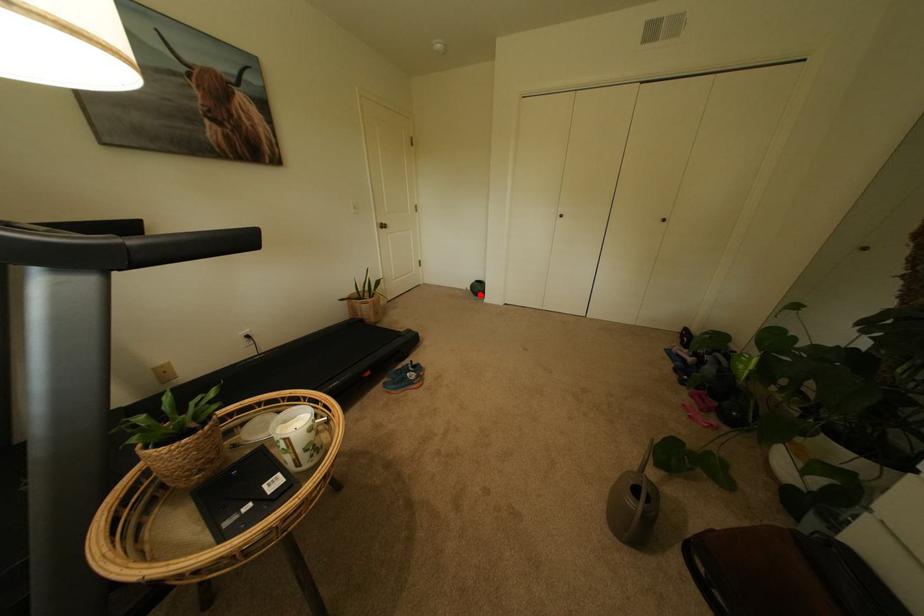
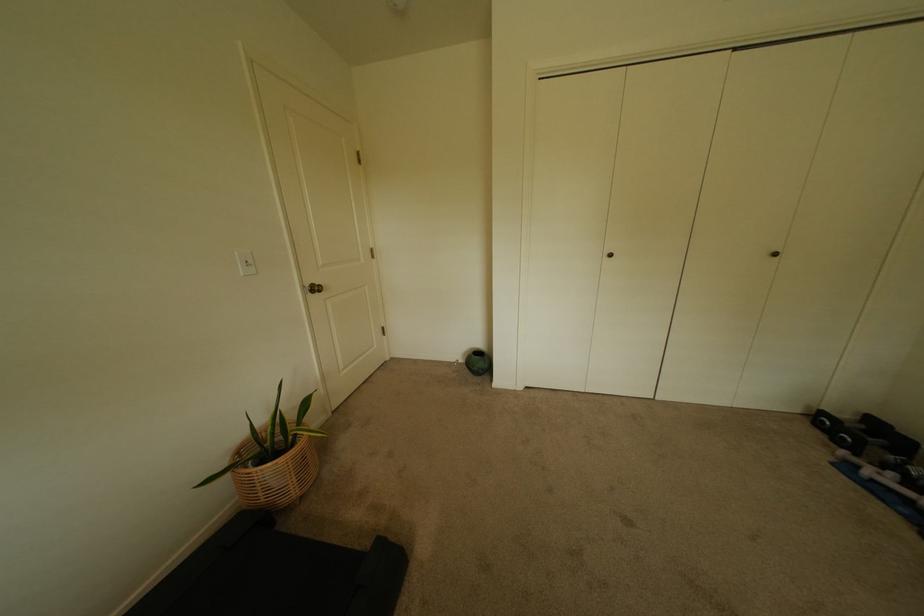
Question: I am providing you with two images of the same scene from different viewpoints. Image1 has a red point marked. In image2, the corresponding 3D location appears at what relative position? Reply with the corresponding letter.

Choices:
 (A) Closer
 (B) Farther

Answer: (B)